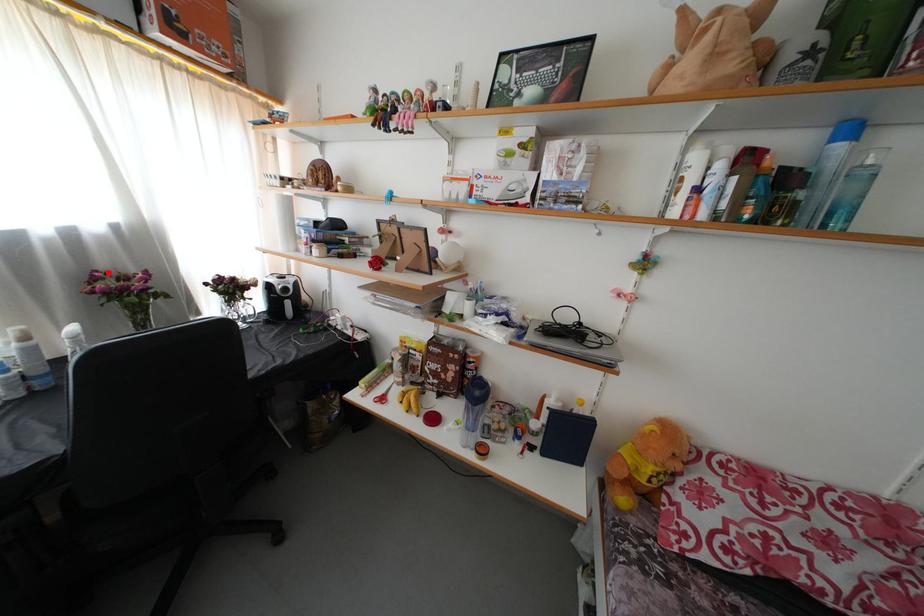
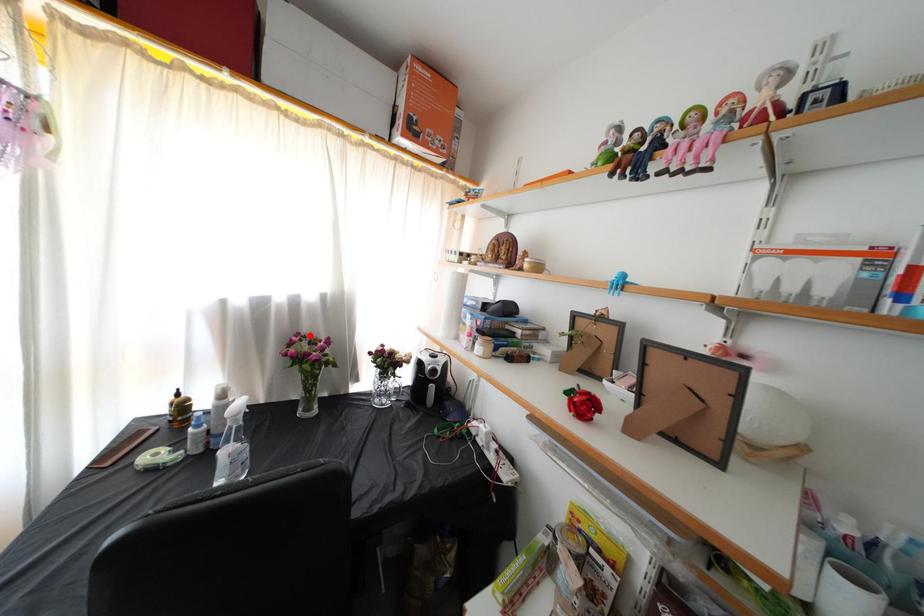
I am providing you with two images of the same scene from different viewpoints. A red point is marked on the first image and another point is marked on the second image. Are the points marked in image1 and image2 representing the same 3D position?

Yes